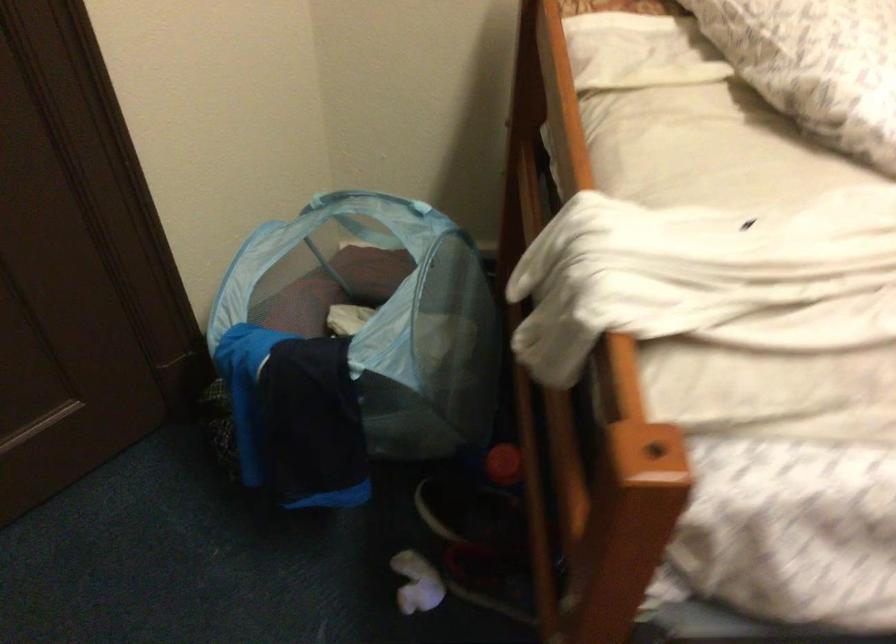
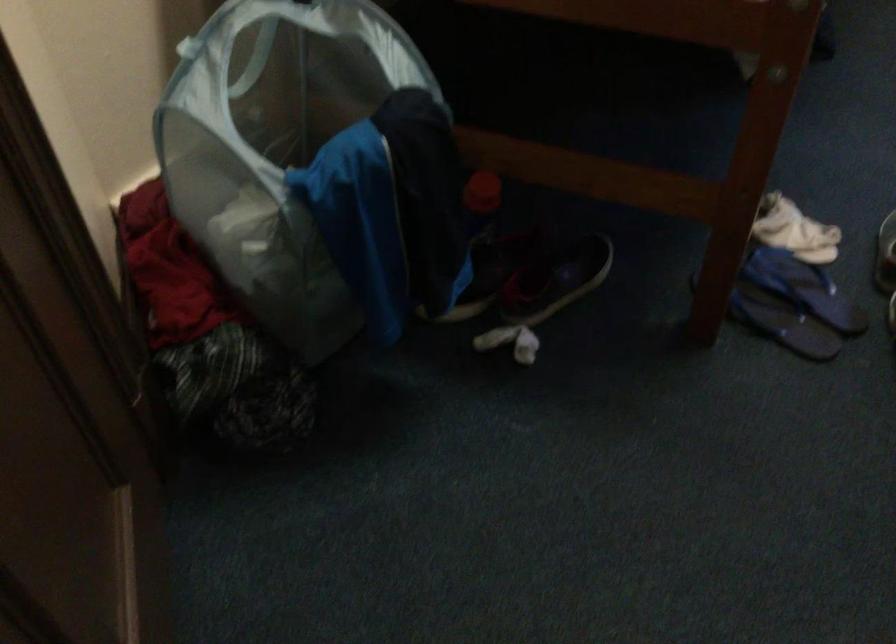
Question: The camera is either moving clockwise (left) or counter-clockwise (right) around the object. The first image is from the beginning of the video and the second image is from the end. Is the camera moving left or right when shooting the video?

Choices:
 (A) Left
 (B) Right

Answer: (A)